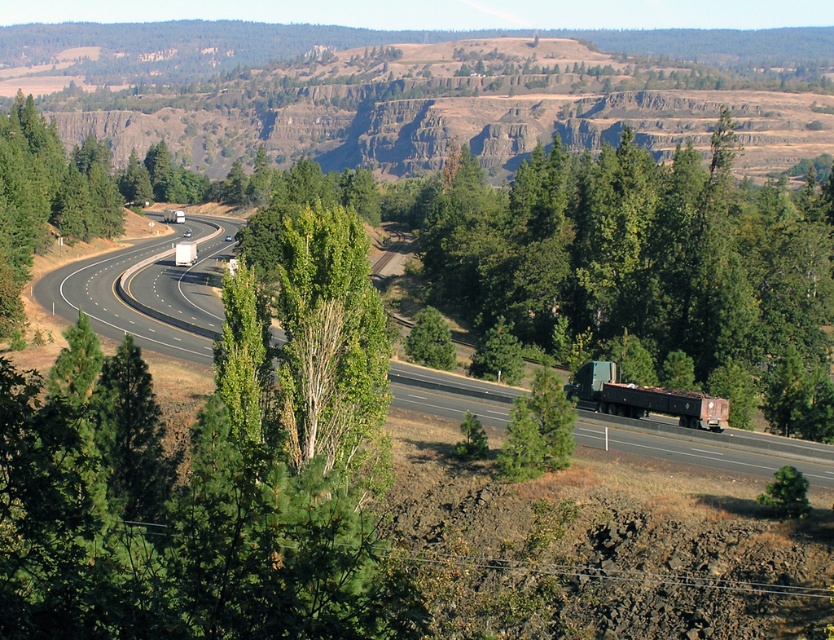
You are standing at the edge of the black asphalt highway at center. You want to walk to a nearby parking lot located 50 meters away from your current position. Based on the scene description, can you safely reach the parking lot without crossing the highway?

The distance between the black asphalt highway at center and the viewer is 44.89 meters. Since the parking lot is 50 meters away, you would need to walk an additional 5.11 meters beyond the highway to reach it. However, the scene description does not mention any pathways or safe crossings, so it is uncertain if there is a safe route available.